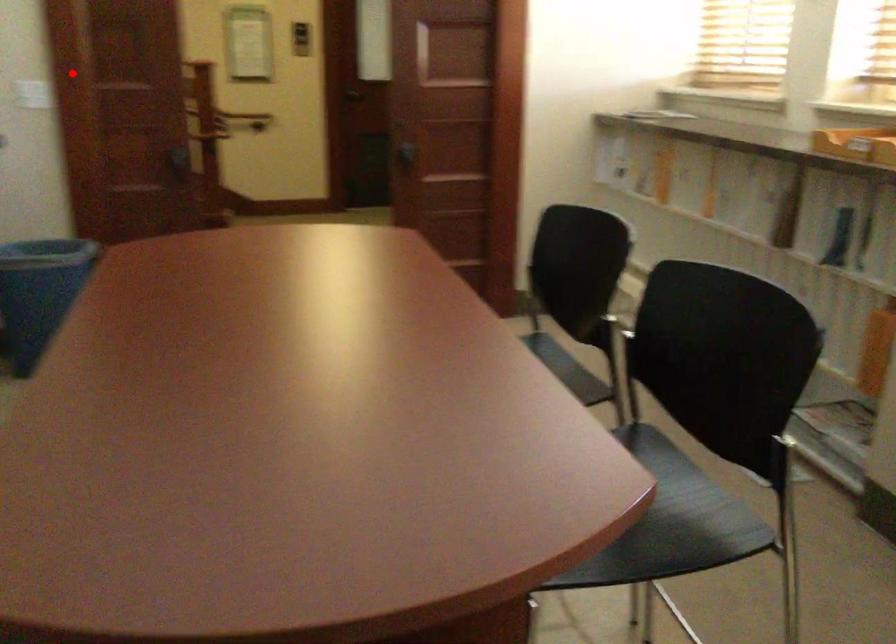
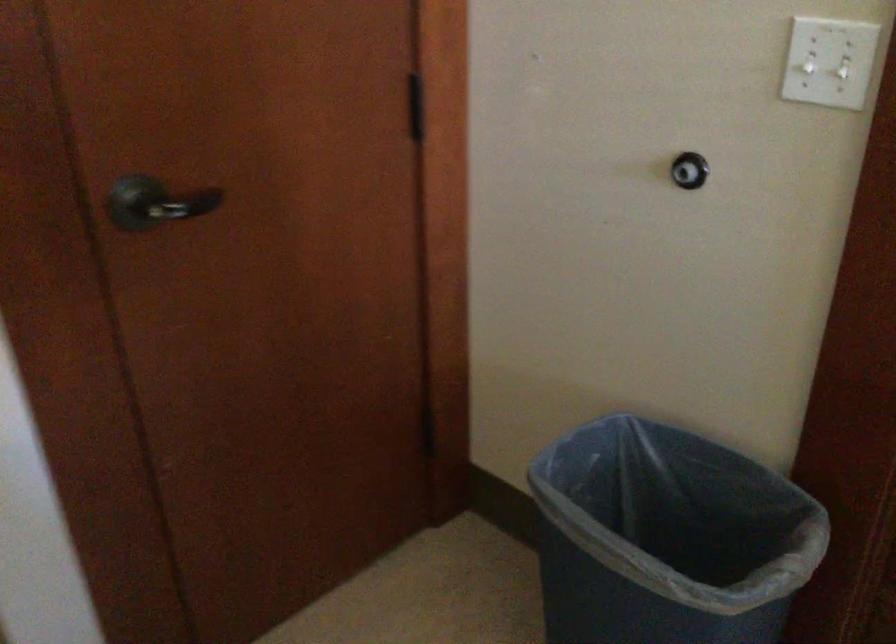
Locate, in the second image, the point that corresponds to the highlighted location in the first image.

(842, 67)